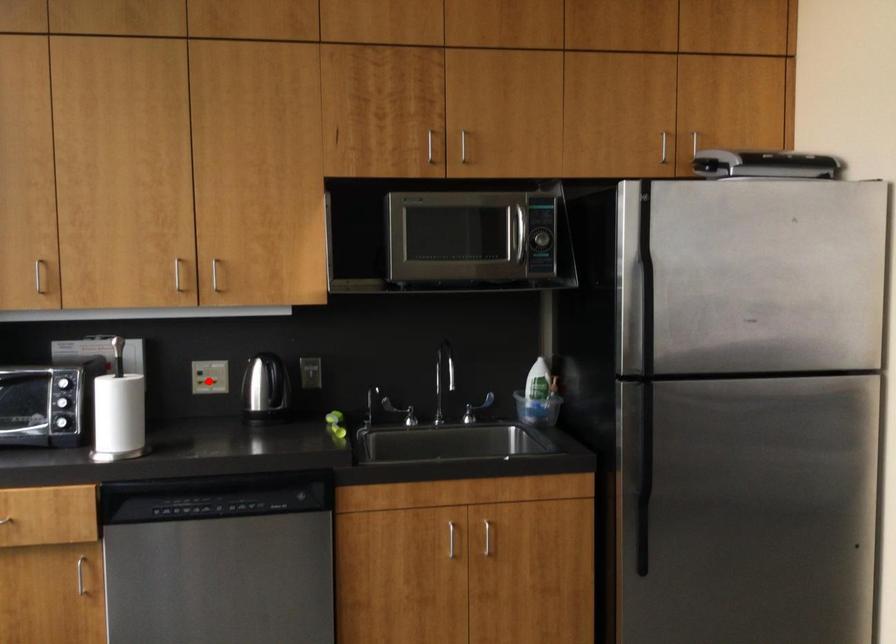
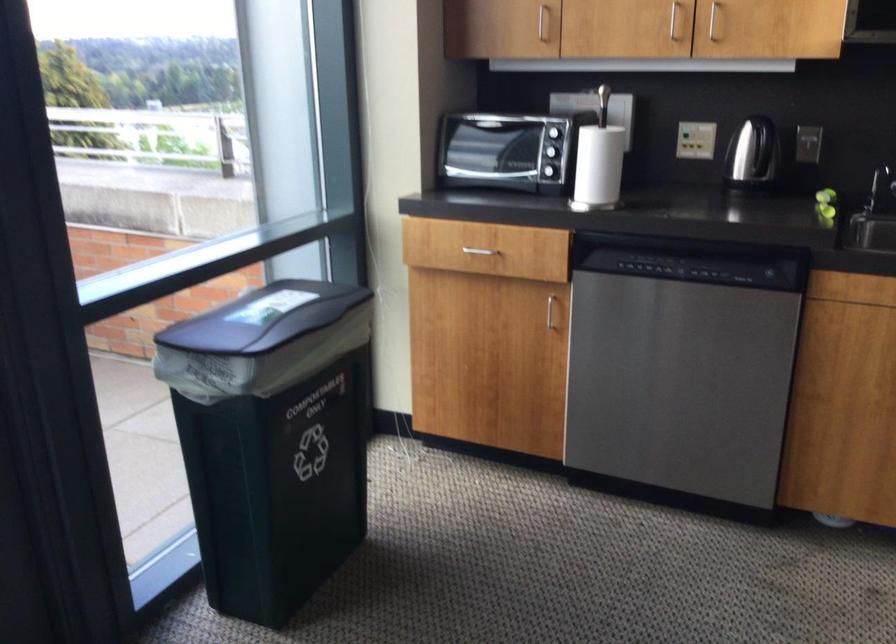
The point at the highlighted location is marked in the first image. Where is the corresponding point in the second image?

(695, 140)